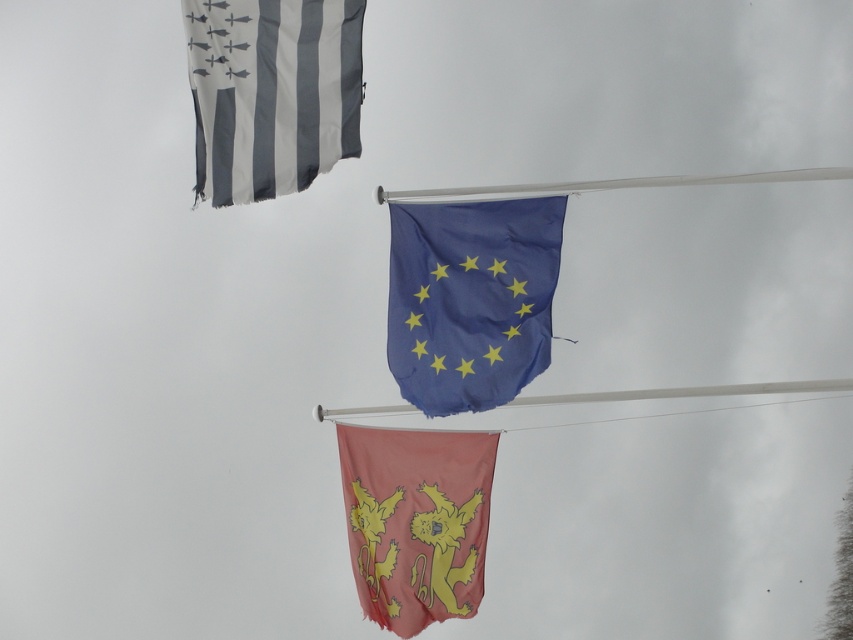
You are a photographer trying to capture a clear shot of the blue fabric flag at center and the gray fabric flag at upper left. Which flag should you focus on first to ensure it appears sharp in the foreground?

The gray fabric flag at upper left should be focused on first because it is closer to the viewer than the blue fabric flag at center, making it the foreground element.

In the scene shown: You are a bird flying over the three flags. You see the point at coordinates (471,300). Which flag is this point located on?

The point at coordinates (471,300) is located on the blue fabric flag at center.